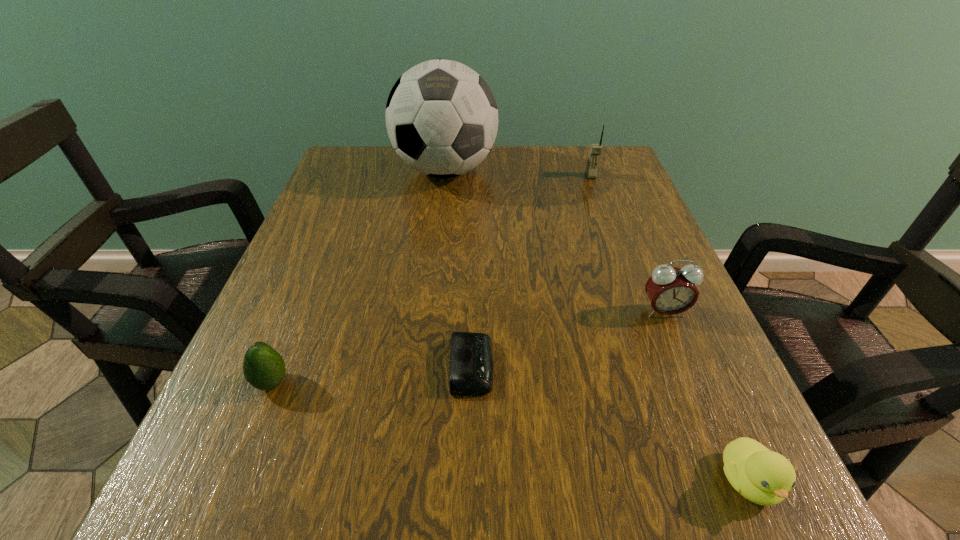
You are a GUI agent. You are given a task and a screenshot of the screen. Output one action in this format:
    pyautogui.click(x=<x>, y=<y>)
    Task: Click on the free space located 0.200m on the clock face of the right alarm clock
    
    Given the screenshot: What is the action you would take?
    pyautogui.click(x=713, y=433)

Locate an element on the screen. The width and height of the screenshot is (960, 540). vacant space located 0.150m on the front of the leftmost object is located at coordinates (220, 511).

Locate an element on the screen. vacant area situated on the display of the shortest object is located at coordinates (540, 366).

I want to click on soccer ball that is at the far edge, so click(x=441, y=116).

Find the location of a particular element. This screenshot has height=540, width=960. cellular telephone that is at the far edge is located at coordinates (595, 150).

The height and width of the screenshot is (540, 960). I want to click on object that is at the near edge, so click(764, 477).

Where is `soccer ball that is at the left edge`? soccer ball that is at the left edge is located at coordinates (441, 116).

What are the coordinates of `avocado at the left edge` in the screenshot? It's located at (263, 367).

You are a GUI agent. You are given a task and a screenshot of the screen. Output one action in this format:
    pyautogui.click(x=<x>, y=<y>)
    Task: Click on the cellular telephone at the right edge
    
    Given the screenshot: What is the action you would take?
    pyautogui.click(x=595, y=150)

In order to click on alarm clock at the right edge in this screenshot , I will do `click(671, 290)`.